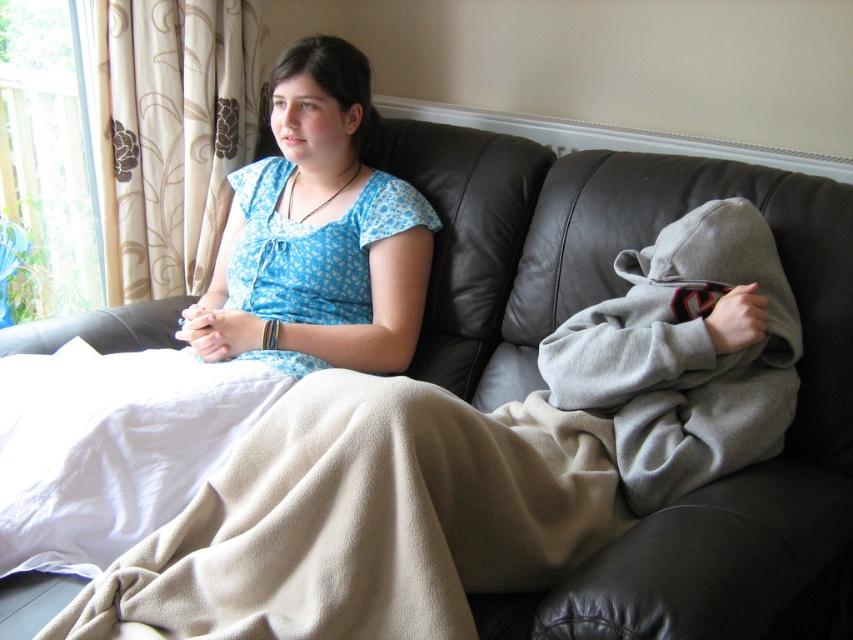
You are a photographer setting up a shoot in this living room. You need to position a 1.2 meter tall backdrop behind the blue printed fabric at center and the beige fleece blanket at lower left. Since the backdrop is taller than both objects, will it cover them adequately?

The blue printed fabric at center is taller than the beige fleece blanket at lower left. Since the backdrop is 1.2 meters tall, it will cover both objects adequately as it is taller than the tallest object, which is the blue printed fabric at center.

From the picture: You are a delivery robot with a package that is 4 inches wide. You need to place the package between the blue cotton shirt at upper center and the beige fleece blanket at lower left. Is there enough space to fit the package there?

The distance between the blue cotton shirt at upper center and the beige fleece blanket at lower left is 3.40 inches. Since the package is 4 inches wide, it will not fit in the available space.